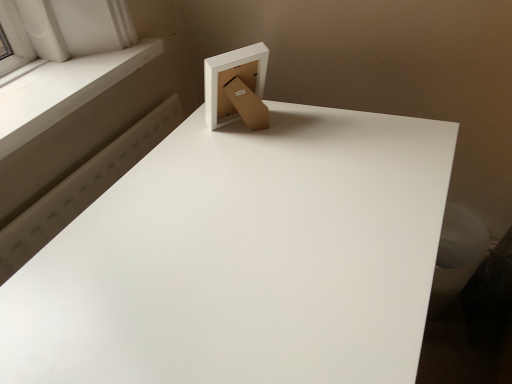
Question: Can you confirm if matte cardboard box at upper center is shorter than white smooth window sill at upper left?

Choices:
 (A) no
 (B) yes

Answer: (A)

Question: From the image's perspective, is matte cardboard box at upper center located beneath white smooth window sill at upper left?

Choices:
 (A) no
 (B) yes

Answer: (B)

Question: Are matte cardboard box at upper center and white smooth window sill at upper left far apart?

Choices:
 (A) yes
 (B) no

Answer: (B)

Question: Is the depth of matte cardboard box at upper center greater than that of white smooth window sill at upper left?

Choices:
 (A) no
 (B) yes

Answer: (B)

Question: From a real-world perspective, is matte cardboard box at upper center located beneath white smooth window sill at upper left?

Choices:
 (A) no
 (B) yes

Answer: (A)

Question: Is matte cardboard box at upper center bigger than white smooth window sill at upper left?

Choices:
 (A) no
 (B) yes

Answer: (A)

Question: Is white smooth window sill at upper left with white matte table at upper center?

Choices:
 (A) no
 (B) yes

Answer: (A)

Question: From a real-world perspective, is white smooth window sill at upper left on top of white matte table at upper center?

Choices:
 (A) no
 (B) yes

Answer: (B)

Question: From the image's perspective, is white smooth window sill at upper left over white matte table at upper center?

Choices:
 (A) no
 (B) yes

Answer: (B)

Question: Considering the relative sizes of white smooth window sill at upper left and white matte table at upper center in the image provided, is white smooth window sill at upper left thinner than white matte table at upper center?

Choices:
 (A) no
 (B) yes

Answer: (B)

Question: Is white smooth window sill at upper left at the right side of white matte table at upper center?

Choices:
 (A) yes
 (B) no

Answer: (B)

Question: From a real-world perspective, is white smooth window sill at upper left physically below white matte table at upper center?

Choices:
 (A) no
 (B) yes

Answer: (A)

Question: Considering the relative sizes of white matte table at upper center and matte cardboard box at upper center in the image provided, is white matte table at upper center thinner than matte cardboard box at upper center?

Choices:
 (A) yes
 (B) no

Answer: (B)